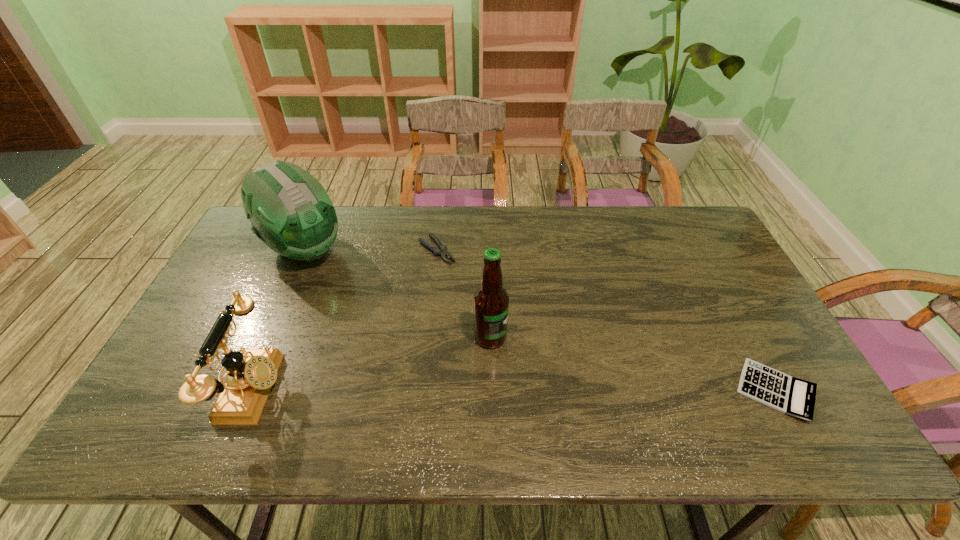
You are a GUI agent. You are given a task and a screenshot of the screen. Output one action in this format:
    pyautogui.click(x=<x>, y=<y>)
    Task: Click on the free spot on the desktop that is between the telephone and the calculator and is positioned on the label of the fourth object from left to right
    This screenshot has height=540, width=960.
    Given the screenshot: What is the action you would take?
    pyautogui.click(x=583, y=390)

The width and height of the screenshot is (960, 540). Find the location of `vacant space on the desktop that is between the telephone and the rightmost object and is positioned on the visor of the football helmet`. vacant space on the desktop that is between the telephone and the rightmost object and is positioned on the visor of the football helmet is located at coordinates (468, 390).

Locate an element on the screen. The image size is (960, 540). vacant spot on the desktop that is between the telephone and the rightmost object and is positioned at the gripping part of the pliers is located at coordinates (590, 390).